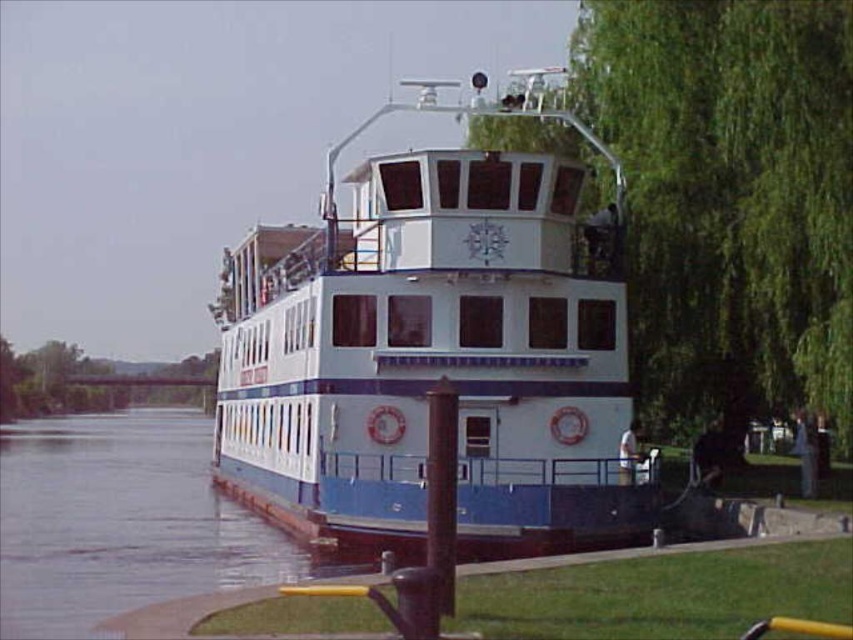
You are standing on the dock of the riverboat and want to take a photo of both the green leafy tree at right and the blue glossy water at lower left. Which object will appear taller in your photo?

The green leafy tree at right will appear taller in the photo because it has a greater height compared to the blue glossy water at lower left.

You are standing on the riverbank looking at the riverboat. There are two points marked on the boat. Which point is closer to you, point (399, 481) or point (801, 184)?

Point (801, 184) is closer to you because it is less further to the camera than point (399, 481).

Consider the image. You are standing on the riverbank and see the white glossy boat at center and the green leafy tree at right. Which object is nearer to you?

The white glossy boat at center is closer to the viewer than the green leafy tree at right.